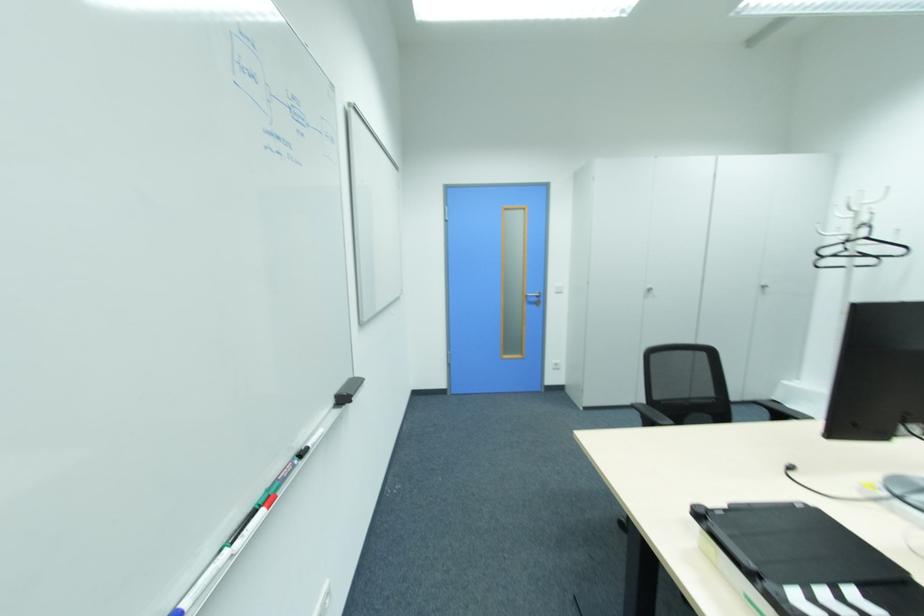
Where would you resting arm the chair armrest? Please return your answer as a coordinate pair (x, y).

(751, 411)